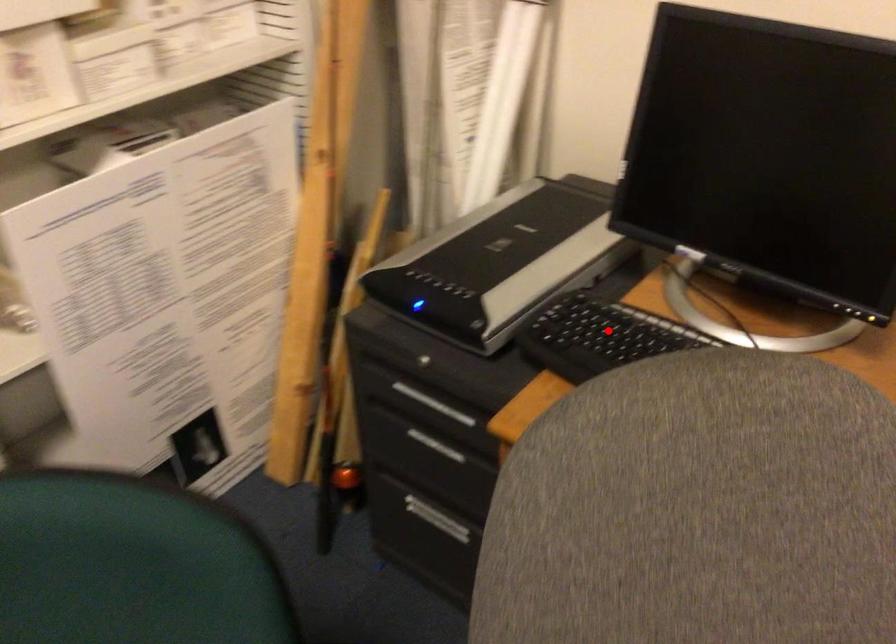
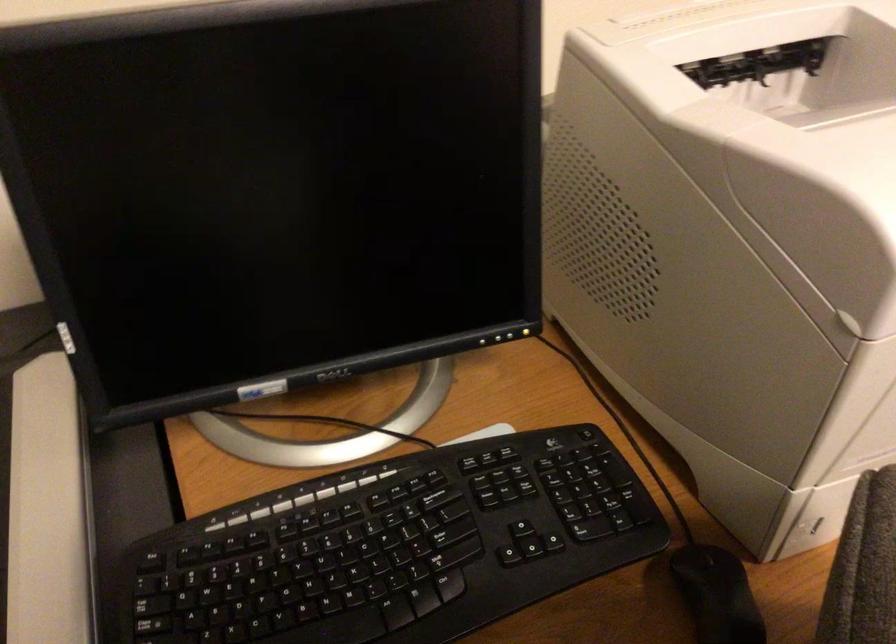
Locate, in the second image, the point that corresponds to the highlighted location in the first image.

(250, 583)